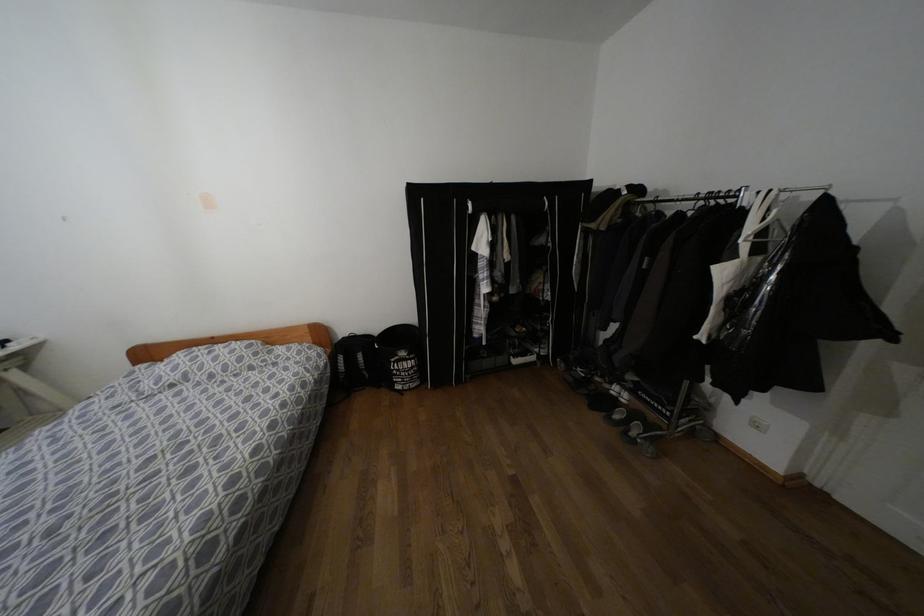
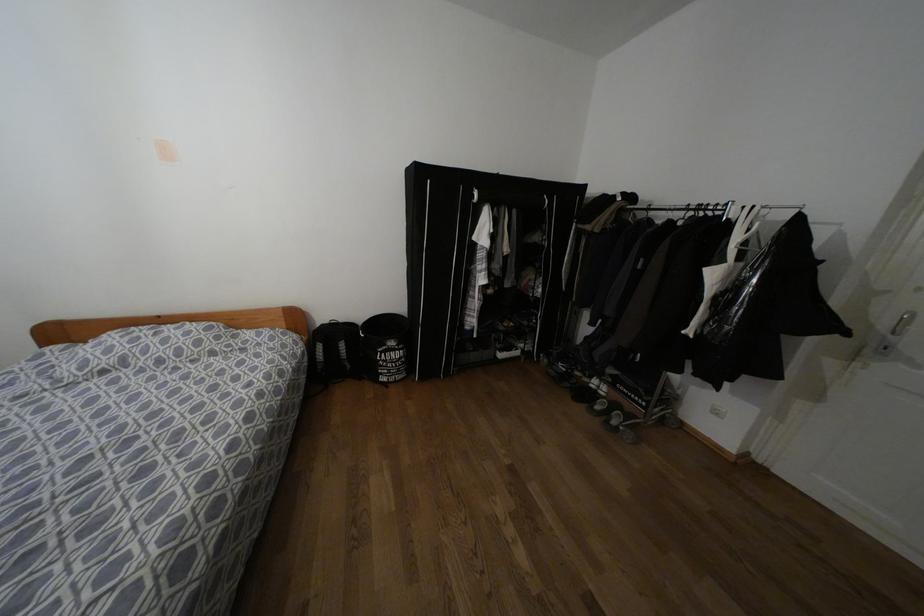
Locate, in the second image, the point that corresponds to [711,203] in the first image.

(700, 214)